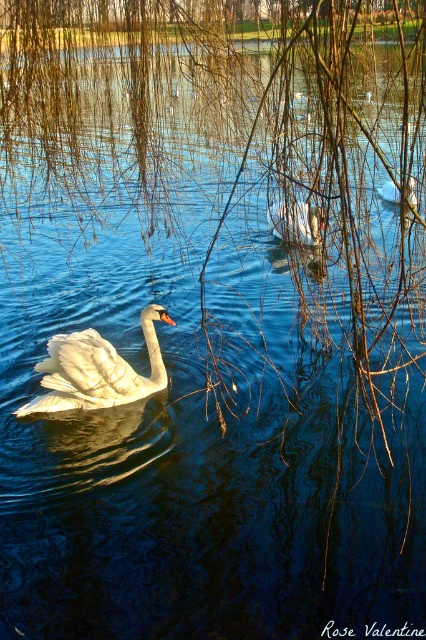
Can you confirm if white glossy swan at center is positioned above white matte duck at center?

No, white glossy swan at center is not above white matte duck at center.

Find the location of a particular element. The height and width of the screenshot is (640, 426). white glossy swan at center is located at coordinates (97, 371).

What are the coordinates of `white glossy swan at center` in the screenshot? It's located at (97, 371).

This screenshot has height=640, width=426. I want to click on white glossy swan at center, so click(97, 371).

Is white glossy swan at center positioned behind white matte goose at center?

No, white glossy swan at center is closer to the viewer.

Where is `white glossy swan at center`? white glossy swan at center is located at coordinates (97, 371).

This screenshot has height=640, width=426. What do you see at coordinates (296, 221) in the screenshot? I see `white matte goose at center` at bounding box center [296, 221].

Identify the location of white matte goose at center. The image size is (426, 640). (296, 221).